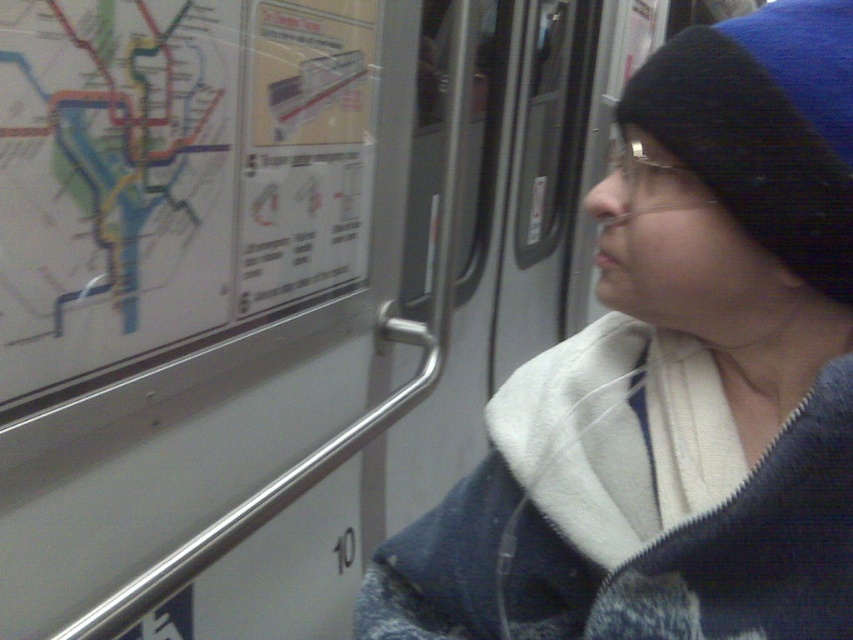
Question: Which of these objects is positioned closest to the blue knit beanie at upper right?

Choices:
 (A) blue knit hat at upper right
 (B) white paper map at upper left

Answer: (A)

Question: Which object is closer to the camera taking this photo?

Choices:
 (A) blue knit beanie at upper right
 (B) white paper map at upper left
 (C) blue knit hat at upper right

Answer: (A)

Question: Is blue knit beanie at upper right to the left of white paper map at upper left from the viewer's perspective?

Choices:
 (A) yes
 (B) no

Answer: (B)

Question: Which point is closer to the camera taking this photo?

Choices:
 (A) (791, 92)
 (B) (109, 170)
 (C) (839, 157)

Answer: (C)

Question: Can you confirm if blue knit beanie at upper right is positioned above white paper map at upper left?

Choices:
 (A) yes
 (B) no

Answer: (B)

Question: Is blue knit beanie at upper right above blue knit hat at upper right?

Choices:
 (A) no
 (B) yes

Answer: (A)